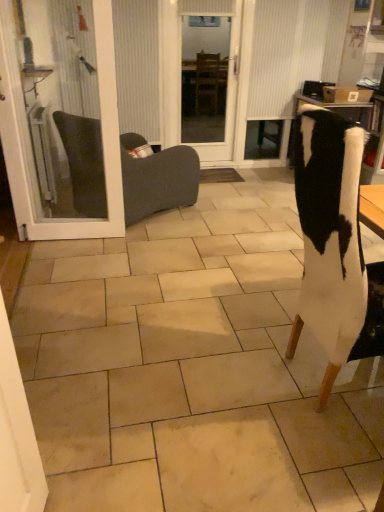
Question: Considering the relative sizes of dark gray fabric chair at left, acting as the 1th chair starting from the left, and white glass door at left in the image provided, is dark gray fabric chair at left, acting as the 1th chair starting from the left, thinner than white glass door at left?

Choices:
 (A) no
 (B) yes

Answer: (A)

Question: From the image's perspective, would you say dark gray fabric chair at left, acting as the 1th chair starting from the left, is positioned over white glass door at left?

Choices:
 (A) no
 (B) yes

Answer: (A)

Question: Considering the relative sizes of dark gray fabric chair at left, which ranks as the 2th chair in right-to-left order, and white glass door at left in the image provided, is dark gray fabric chair at left, which ranks as the 2th chair in right-to-left order, smaller than white glass door at left?

Choices:
 (A) no
 (B) yes

Answer: (A)

Question: Would you say dark gray fabric chair at left, which ranks as the 2th chair in right-to-left order, contains white glass door at left?

Choices:
 (A) yes
 (B) no

Answer: (B)

Question: Are dark gray fabric chair at left, which is the second chair in front-to-back order, and white glass door at left located far from each other?

Choices:
 (A) yes
 (B) no

Answer: (B)

Question: From a real-world perspective, is transparent glass door at center positioned above or below white glass door at left?

Choices:
 (A) above
 (B) below

Answer: (A)

Question: In terms of height, does transparent glass door at center look taller or shorter compared to white glass door at left?

Choices:
 (A) short
 (B) tall

Answer: (B)

Question: Is transparent glass door at center inside or outside of white glass door at left?

Choices:
 (A) inside
 (B) outside

Answer: (B)

Question: Considering the positions of point (221, 144) and point (105, 12), is point (221, 144) closer or farther from the camera than point (105, 12)?

Choices:
 (A) closer
 (B) farther

Answer: (B)

Question: Is dark gray fabric chair at left, which is the second chair in front-to-back order, taller or shorter than transparent glass door at center?

Choices:
 (A) tall
 (B) short

Answer: (B)

Question: In the image, is dark gray fabric chair at left, which is the 1th chair in back-to-front order, positioned in front of or behind transparent glass door at center?

Choices:
 (A) behind
 (B) front

Answer: (B)

Question: Based on their sizes in the image, would you say dark gray fabric chair at left, acting as the 1th chair starting from the left, is bigger or smaller than transparent glass door at center?

Choices:
 (A) small
 (B) big

Answer: (B)

Question: Which is correct: dark gray fabric chair at left, which is the 1th chair in back-to-front order, is inside transparent glass door at center, or outside of it?

Choices:
 (A) inside
 (B) outside

Answer: (B)

Question: Considering the positions of white fur chair at right, which is counted as the first chair, starting from the front, and dark gray fabric chair at left, acting as the 1th chair starting from the left, in the image, is white fur chair at right, which is counted as the first chair, starting from the front, bigger or smaller than dark gray fabric chair at left, acting as the 1th chair starting from the left,?

Choices:
 (A) small
 (B) big

Answer: (A)

Question: Is white fur chair at right, placed as the first chair when sorted from right to left, taller or shorter than dark gray fabric chair at left, which ranks as the 2th chair in right-to-left order?

Choices:
 (A) short
 (B) tall

Answer: (B)